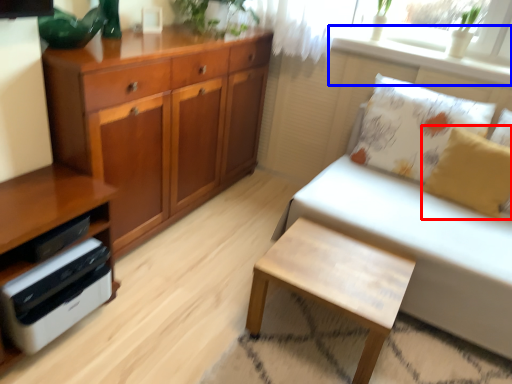
Question: Which point is closer to the camera, pillow (highlighted by a red box) or window sill (highlighted by a blue box)?

Choices:
 (A) pillow
 (B) window sill

Answer: (A)